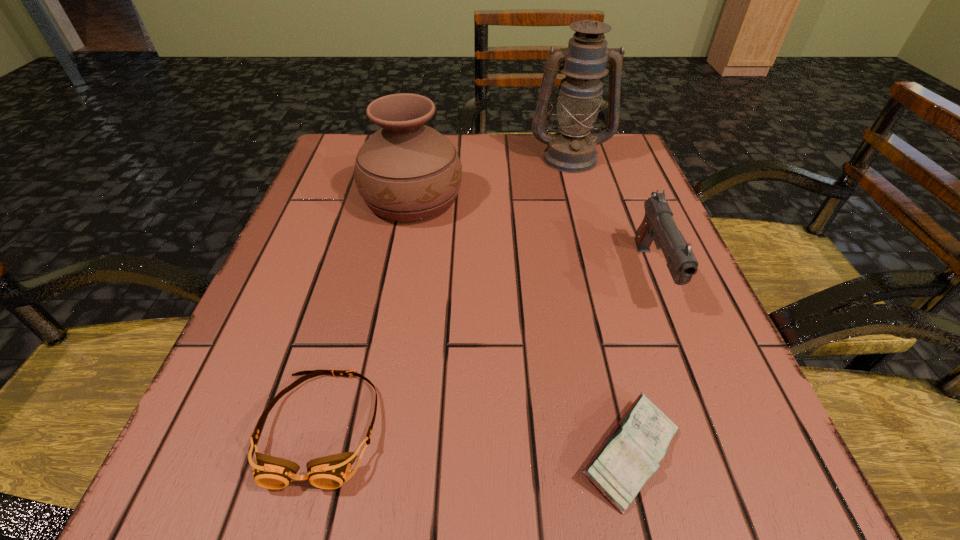
Where is `object present at the near left corner`? The width and height of the screenshot is (960, 540). object present at the near left corner is located at coordinates (330, 472).

The width and height of the screenshot is (960, 540). I want to click on object at the far right corner, so click(572, 150).

At what (x,y) coordinates should I click in order to perform the action: click on object present at the near right corner. Please return your answer as a coordinate pair (x, y). The height and width of the screenshot is (540, 960). Looking at the image, I should click on (630, 455).

In order to click on vacant space at the far edge of the desktop in this screenshot , I will do `click(465, 175)`.

The image size is (960, 540). I want to click on free location at the near edge of the desktop, so click(x=597, y=498).

Identify the location of vacant space at the left edge of the desktop. (304, 343).

The width and height of the screenshot is (960, 540). What are the coordinates of `vacant space at the right edge` in the screenshot? It's located at (612, 237).

Find the location of a particular element. vacant space that is in between the goggles and the tallest object is located at coordinates coord(445,292).

You are a GUI agent. You are given a task and a screenshot of the screen. Output one action in this format:
    pyautogui.click(x=<x>, y=<y>)
    Task: Click on the free space between the goggles and the diary
    The height and width of the screenshot is (540, 960).
    Given the screenshot: What is the action you would take?
    pyautogui.click(x=476, y=440)

You are a GUI agent. You are given a task and a screenshot of the screen. Output one action in this format:
    pyautogui.click(x=<x>, y=<y>)
    Task: Click on the free space between the goggles and the third farthest object
    This screenshot has height=540, width=960.
    Given the screenshot: What is the action you would take?
    pyautogui.click(x=487, y=350)